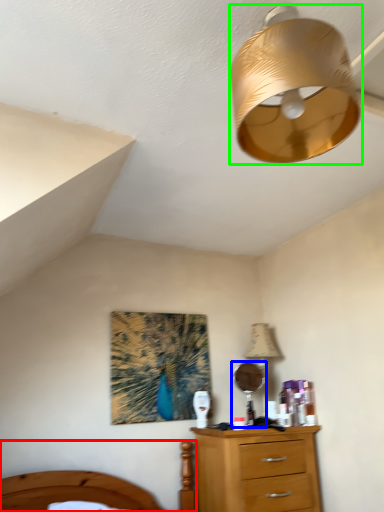
Question: Which object is the farthest from bed (highlighted by a red box)? Choose among these: mirror (highlighted by a blue box) or lamp (highlighted by a green box).

Choices:
 (A) mirror
 (B) lamp

Answer: (B)